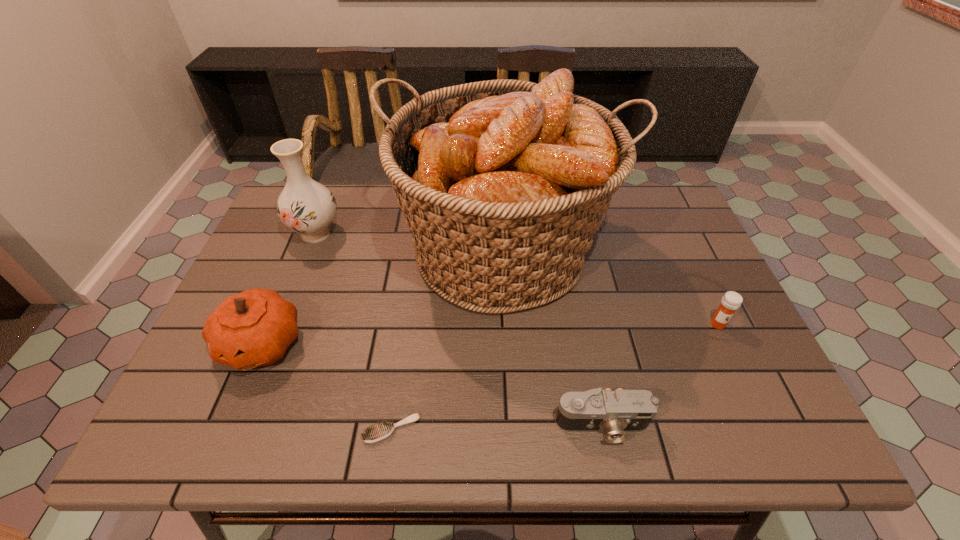
Where is `free location located 0.310m on the back of the shortest object`? The image size is (960, 540). free location located 0.310m on the back of the shortest object is located at coordinates (410, 300).

Image resolution: width=960 pixels, height=540 pixels. I want to click on basket situated at the far edge, so click(503, 183).

Locate an element on the screen. This screenshot has width=960, height=540. vase positioned at the far edge is located at coordinates (305, 206).

Locate an element on the screen. The height and width of the screenshot is (540, 960). camera located at the near edge is located at coordinates (616, 412).

In order to click on scrubbing brush located at the near edge in this screenshot , I will do `click(378, 432)`.

Identify the location of vase that is at the left edge. The width and height of the screenshot is (960, 540). coord(305,206).

Locate an element on the screen. This screenshot has height=540, width=960. pumpkin present at the left edge is located at coordinates (254, 328).

Identify the location of object that is at the right edge. point(731,301).

Where is `object present at the far left corner`? This screenshot has height=540, width=960. object present at the far left corner is located at coordinates point(305,206).

You are a GUI agent. You are given a task and a screenshot of the screen. Output one action in this format:
    pyautogui.click(x=<x>, y=<y>)
    Task: Click on the vacant position at the near edge of the desktop
    This screenshot has height=540, width=960.
    Given the screenshot: What is the action you would take?
    tap(276, 425)